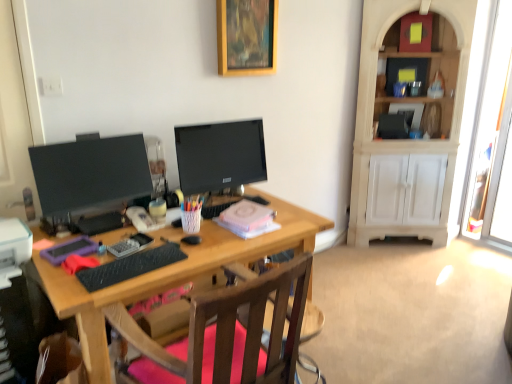
This screenshot has width=512, height=384. Describe the element at coordinates (247, 37) in the screenshot. I see `wooden picture frame at upper center` at that location.

Locate an element on the screen. wooden desk at center is located at coordinates (170, 274).

What do you see at coordinates (69, 250) in the screenshot?
I see `purple matte case at left, which is the 3th stationery in right-to-left order` at bounding box center [69, 250].

Describe the element at coordinates (220, 155) in the screenshot. The width and height of the screenshot is (512, 384). I see `matte black monitor at center, arranged as the 1th television when viewed from the right` at that location.

Describe the element at coordinates (130, 245) in the screenshot. The image size is (512, 384). I see `clear plastic tray at center, the 2th stationery from the right` at that location.

This screenshot has height=384, width=512. In order to click on wooden picture frame at upper center in this screenshot , I will do `click(247, 37)`.

Where is `television on the left of clear plastic tray at center, the 2th stationery from the right`? The height and width of the screenshot is (384, 512). television on the left of clear plastic tray at center, the 2th stationery from the right is located at coordinates (90, 173).

From the image's perspective, would you say matte black monitor at left, the 1th television positioned from the left, is shown under clear plastic tray at center, the 2th stationery viewed from the left?

No, from the image's perspective, matte black monitor at left, the 1th television positioned from the left, is not below clear plastic tray at center, the 2th stationery viewed from the left.

Considering the relative sizes of white woven pen holder at center, the third stationery in the left-to-right sequence, and wooden picture frame at upper center in the image provided, is white woven pen holder at center, the third stationery in the left-to-right sequence, thinner than wooden picture frame at upper center?

No, white woven pen holder at center, the third stationery in the left-to-right sequence, is not thinner than wooden picture frame at upper center.

Which object is positioned more to the left, white woven pen holder at center, the third stationery in the left-to-right sequence, or wooden picture frame at upper center?

Positioned to the left is white woven pen holder at center, the third stationery in the left-to-right sequence.

Is white woven pen holder at center, the third stationery in the left-to-right sequence, outside of wooden picture frame at upper center?

Yes.

Between point (190, 229) and point (266, 34), which one is positioned behind?

The point (266, 34) is behind.

How different are the orientations of wooden picture frame at upper center and black rubberized keyboard at center in degrees?

The angle between the facing direction of wooden picture frame at upper center and the facing direction of black rubberized keyboard at center is 4.7 degrees.

Which is less distant, (221, 58) or (92, 271)?

The point (92, 271) is closer to the camera.

Is wooden picture frame at upper center not close to black rubberized keyboard at center?

Indeed, wooden picture frame at upper center is not near black rubberized keyboard at center.

From a real-world perspective, which is physically below, wooden picture frame at upper center or black rubberized keyboard at center?

From a 3D spatial view, black rubberized keyboard at center is below.

Where is `computer keyboard below the white woven pen holder at center, acting as the 1th stationery starting from the right (from the image's perspective)`? computer keyboard below the white woven pen holder at center, acting as the 1th stationery starting from the right (from the image's perspective) is located at coordinates (130, 266).

Between black rubberized keyboard at center and white woven pen holder at center, the third stationery in the left-to-right sequence, which one is positioned in front?

black rubberized keyboard at center is in front.

Is point (103, 268) positioned behind point (194, 210)?

That is False.

From a real-world perspective, who is located higher, black rubberized keyboard at center or white woven pen holder at center, the third stationery in the left-to-right sequence?

white woven pen holder at center, the third stationery in the left-to-right sequence, is physically above.

Is white woven pen holder at center, acting as the 1th stationery starting from the right, inside the boundaries of clear plastic tray at center, the 2th stationery viewed from the left, or outside?

white woven pen holder at center, acting as the 1th stationery starting from the right, is not inside clear plastic tray at center, the 2th stationery viewed from the left, it's outside.

Does white woven pen holder at center, acting as the 1th stationery starting from the right, turn towards clear plastic tray at center, the 2th stationery viewed from the left?

No, white woven pen holder at center, acting as the 1th stationery starting from the right, is not aimed at clear plastic tray at center, the 2th stationery viewed from the left.

Does white woven pen holder at center, the third stationery in the left-to-right sequence, have a smaller size compared to clear plastic tray at center, the 2th stationery from the right?

Yes, white woven pen holder at center, the third stationery in the left-to-right sequence, is smaller than clear plastic tray at center, the 2th stationery from the right.

Is white woven pen holder at center, the third stationery in the left-to-right sequence, taller than clear plastic tray at center, the 2th stationery from the right?

Indeed, white woven pen holder at center, the third stationery in the left-to-right sequence, has a greater height compared to clear plastic tray at center, the 2th stationery from the right.

Is wooden desk at center with black plastic computer tower at lower left?

wooden desk at center is not next to black plastic computer tower at lower left, and they're not touching.

Is black plastic computer tower at lower left a part of wooden desk at center?

No, black plastic computer tower at lower left is located outside of wooden desk at center.

Looking at the image, does wooden desk at center seem bigger or smaller compared to black plastic computer tower at lower left?

Considering their sizes, wooden desk at center takes up more space than black plastic computer tower at lower left.

Does wooden desk at center lie in front of black plastic computer tower at lower left?

Yes, wooden desk at center is closer to the viewer.

Between matte black monitor at left, which is counted as the second television, starting from the right, and matte black monitor at center, the second television in the left-to-right sequence, which one appears on the right side from the viewer's perspective?

Positioned to the right is matte black monitor at center, the second television in the left-to-right sequence.

From a real-world perspective, is matte black monitor at left, which is counted as the second television, starting from the right, above or below matte black monitor at center, the second television in the left-to-right sequence?

From a real-world perspective, matte black monitor at left, which is counted as the second television, starting from the right, is physically below matte black monitor at center, the second television in the left-to-right sequence.

I want to click on television above the matte black monitor at left, the 1th television positioned from the left (from the image's perspective), so click(220, 155).

Considering the sizes of matte black monitor at left, which is counted as the second television, starting from the right, and matte black monitor at center, arranged as the 1th television when viewed from the right, in the image, is matte black monitor at left, which is counted as the second television, starting from the right, taller or shorter than matte black monitor at center, arranged as the 1th television when viewed from the right,?

Considering their sizes, matte black monitor at left, which is counted as the second television, starting from the right, has less height than matte black monitor at center, arranged as the 1th television when viewed from the right.

From the image's perspective, count 2nd stationerys downward from the matte black monitor at left, which is counted as the second television, starting from the right, and point to it. Please provide its 2D coordinates.

[(130, 245)]

At what (x,y) coordinates should I click in order to perform the action: click on picture frame behind the white woven pen holder at center, the third stationery in the left-to-right sequence. Please return your answer as a coordinate pair (x, y). Image resolution: width=512 pixels, height=384 pixels. Looking at the image, I should click on pyautogui.click(x=247, y=37).

Which object lies further to the anchor point matte black monitor at center, arranged as the 1th television when viewed from the right, clear plastic tray at center, the 2th stationery from the right, or purple matte case at left, which is the 3th stationery in right-to-left order?

The object further to matte black monitor at center, arranged as the 1th television when viewed from the right, is purple matte case at left, which is the 3th stationery in right-to-left order.

Looking at the image, which one is located further to matte black monitor at center, the second television in the left-to-right sequence, wooden desk at center or black rubberized keyboard at center?

Among the two, black rubberized keyboard at center is located further to matte black monitor at center, the second television in the left-to-right sequence.

Looking at the image, which one is located closer to white woven pen holder at center, acting as the 1th stationery starting from the right, black rubberized keyboard at center or matte black monitor at left, which is counted as the second television, starting from the right?

black rubberized keyboard at center lies closer to white woven pen holder at center, acting as the 1th stationery starting from the right, than the other object.

Which object lies nearer to the anchor point white woven pen holder at center, acting as the 1th stationery starting from the right, wooden picture frame at upper center or matte black monitor at center, the second television in the left-to-right sequence?

Among the two, matte black monitor at center, the second television in the left-to-right sequence, is located nearer to white woven pen holder at center, acting as the 1th stationery starting from the right.

Looking at the image, which one is located closer to clear plastic tray at center, the 2th stationery viewed from the left, black rubberized keyboard at center or wooden desk at center?

black rubberized keyboard at center is closer to clear plastic tray at center, the 2th stationery viewed from the left.

Looking at the image, which one is located further to purple matte case at left, which is the 3th stationery in right-to-left order, matte black monitor at left, which is counted as the second television, starting from the right, or black plastic computer tower at lower left?

The object further to purple matte case at left, which is the 3th stationery in right-to-left order, is matte black monitor at left, which is counted as the second television, starting from the right.

Estimate the real-world distances between objects in this image. Which object is further from matte black monitor at left, the 1th television positioned from the left, wooden desk at center or black plastic computer tower at lower left?

black plastic computer tower at lower left is further to matte black monitor at left, the 1th television positioned from the left.

Based on the photo, estimate the real-world distances between objects in this image. Which object is further from clear plastic tray at center, the 2th stationery viewed from the left, black rubberized keyboard at center or purple matte case at left, which is the 3th stationery in right-to-left order?

Among the two, purple matte case at left, which is the 3th stationery in right-to-left order, is located further to clear plastic tray at center, the 2th stationery viewed from the left.

Identify the location of television between black plastic computer tower at lower left and white woven pen holder at center, acting as the 1th stationery starting from the right. (90, 173).

Locate an element on the screen. The width and height of the screenshot is (512, 384). television between wooden desk at center and matte black monitor at center, the second television in the left-to-right sequence, along the z-axis is located at coordinates 90,173.

Find the location of a particular element. This screenshot has height=384, width=512. stationery between matte black monitor at left, the 1th television positioned from the left, and white woven pen holder at center, the third stationery in the left-to-right sequence, in the horizontal direction is located at coordinates (130, 245).

Image resolution: width=512 pixels, height=384 pixels. I want to click on stationery situated between purple matte case at left, which is the 3th stationery in right-to-left order, and black rubberized keyboard at center from left to right, so click(x=130, y=245).